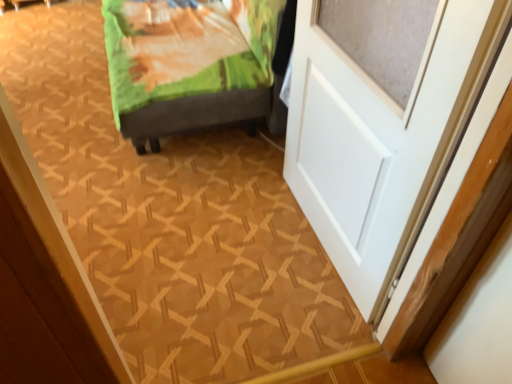
Where is `free space between white matte door at right and green fabric bed at upper left`? free space between white matte door at right and green fabric bed at upper left is located at coordinates pos(240,219).